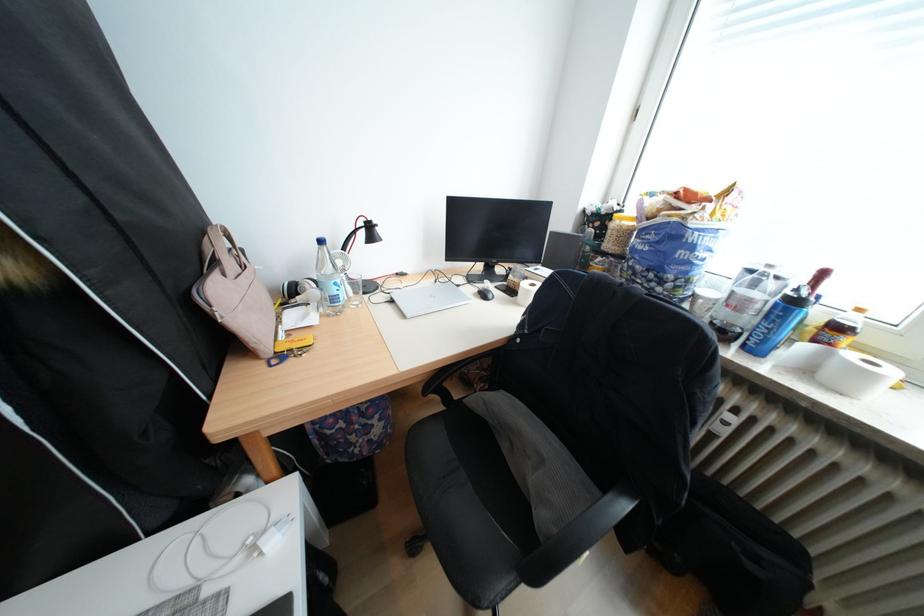
Find where to adjust the black desk lamp head. Please return your answer as a coordinate pair (x, y).

(361, 233)